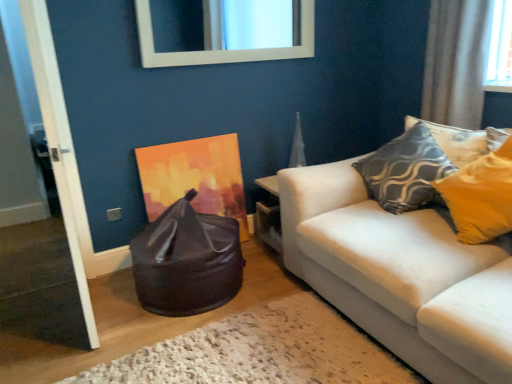
Question: Should I look upward or downward to see white sheer curtain at upper right?

Choices:
 (A) down
 (B) up

Answer: (B)

Question: Is white glossy mirror at upper center positioned far away from glossy black bean bag at lower left?

Choices:
 (A) no
 (B) yes

Answer: (B)

Question: Is glossy black bean bag at lower left located within white glossy mirror at upper center?

Choices:
 (A) no
 (B) yes

Answer: (A)

Question: Does white glossy mirror at upper center appear on the left side of glossy black bean bag at lower left?

Choices:
 (A) no
 (B) yes

Answer: (A)

Question: From a real-world perspective, is white glossy mirror at upper center physically above glossy black bean bag at lower left?

Choices:
 (A) no
 (B) yes

Answer: (B)

Question: Considering the relative sizes of white glossy mirror at upper center and glossy black bean bag at lower left in the image provided, is white glossy mirror at upper center bigger than glossy black bean bag at lower left?

Choices:
 (A) yes
 (B) no

Answer: (B)

Question: Is white glossy mirror at upper center in front of glossy black bean bag at lower left?

Choices:
 (A) yes
 (B) no

Answer: (B)

Question: Can you confirm if white wooden door at left is smaller than white sheer curtain at upper right?

Choices:
 (A) no
 (B) yes

Answer: (A)

Question: Is white wooden door at left bigger than white sheer curtain at upper right?

Choices:
 (A) yes
 (B) no

Answer: (A)

Question: Considering the relative positions of white wooden door at left and white sheer curtain at upper right in the image provided, is white wooden door at left to the left of white sheer curtain at upper right from the viewer's perspective?

Choices:
 (A) yes
 (B) no

Answer: (A)

Question: From a real-world perspective, does white wooden door at left sit lower than white sheer curtain at upper right?

Choices:
 (A) yes
 (B) no

Answer: (A)

Question: Is white wooden door at left at the right side of white sheer curtain at upper right?

Choices:
 (A) yes
 (B) no

Answer: (B)

Question: From the image's perspective, is white wooden door at left under white sheer curtain at upper right?

Choices:
 (A) yes
 (B) no

Answer: (A)

Question: From the image's perspective, is white wooden door at left above textured gray pillow at upper right?

Choices:
 (A) no
 (B) yes

Answer: (A)